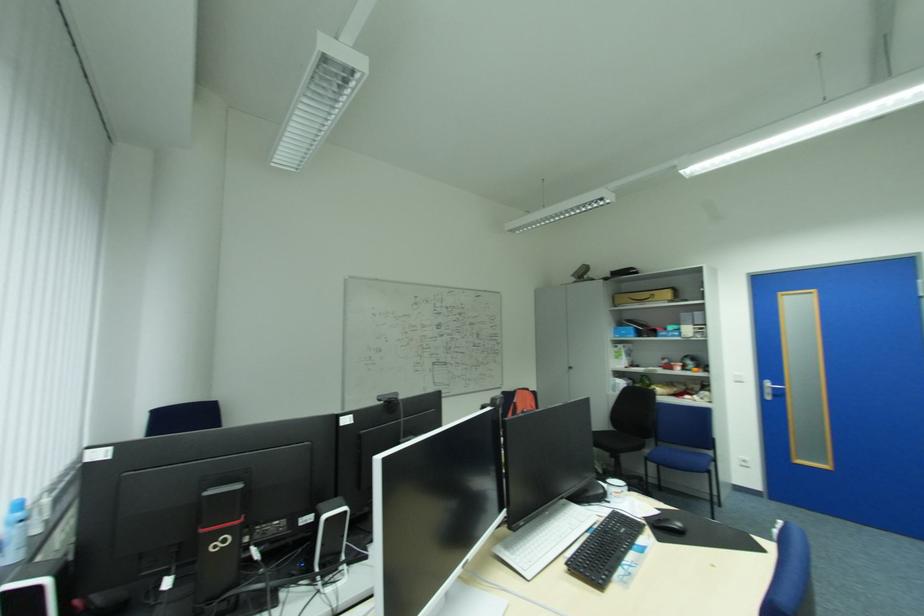
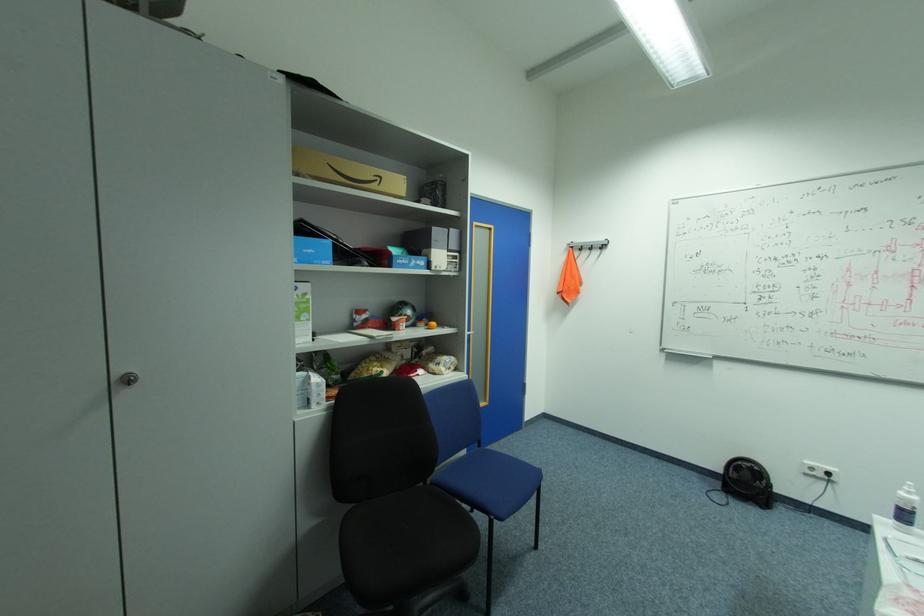
Find the pixel in the second image that matches (x=577, y=368) in the first image.

(137, 379)